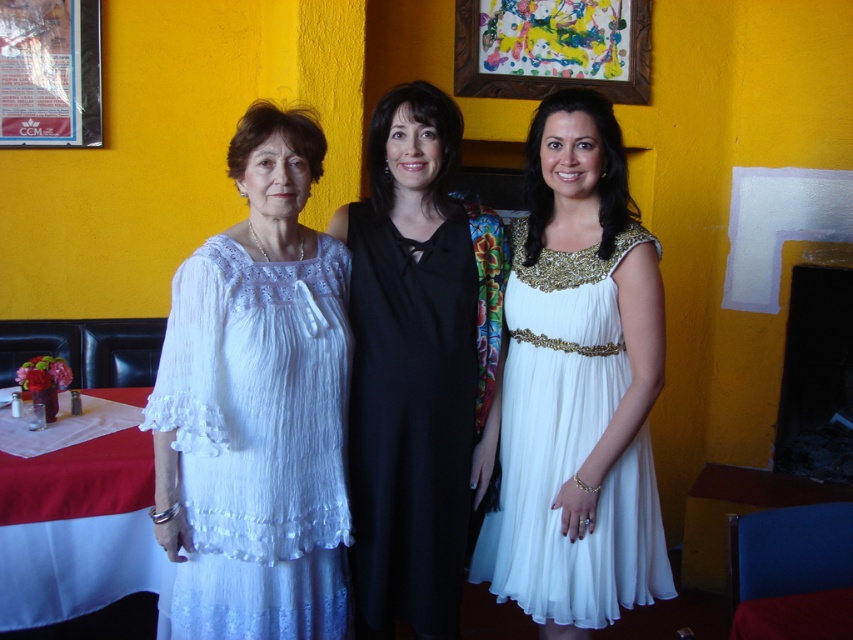
You are standing in a restaurant and want to hang a new painting exactly where the painted wood picture frame at upper center is currently located. What are the coordinates of the spot where you should place the new painting?

The coordinates for the painted wood picture frame at upper center are at point (x=552, y=48), so you should place the new painting at those coordinates.

You are a photographer setting up a shoot in the dining area. You have a camera that requires a minimum distance of 18 inches between the two white items to capture them both clearly in the frame. Given the white sheer dress at left and the white cloth at lower left, can you fit both into your camera frame?

The white sheer dress at left and white cloth at lower left are 16.42 inches apart, which is less than the required 18 inches. Therefore, you cannot fit both into the camera frame.